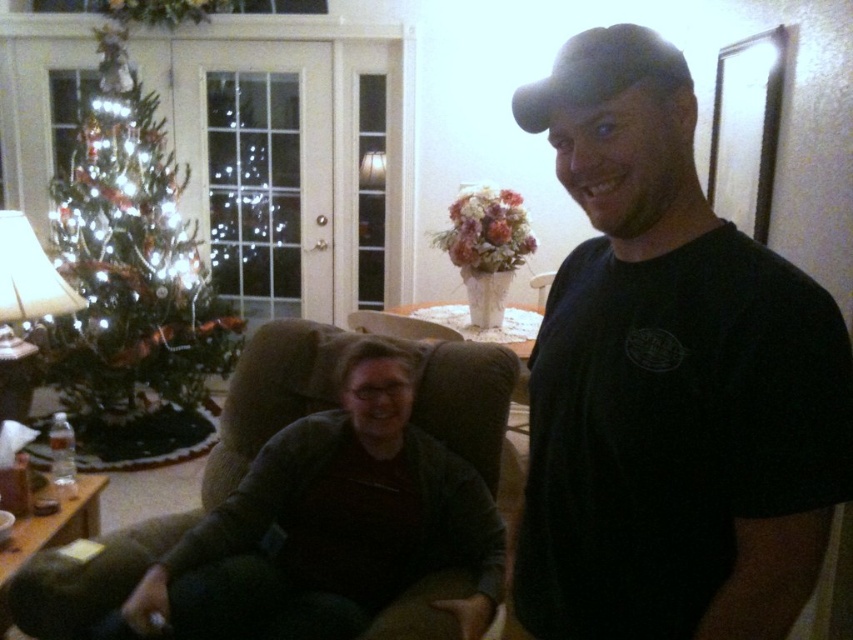
Question: Does black matte t-shirt at center have a smaller size compared to brown fabric couch at lower left?

Choices:
 (A) yes
 (B) no

Answer: (A)

Question: Which point is closer to the camera taking this photo?

Choices:
 (A) (732, 436)
 (B) (96, 342)

Answer: (A)

Question: Does green matte christmas tree at left appear under brown fabric couch at lower left?

Choices:
 (A) yes
 (B) no

Answer: (B)

Question: Which point is farther from the camera taking this photo?

Choices:
 (A) (634, 200)
 (B) (463, 424)
 (C) (88, 216)

Answer: (C)

Question: Does green matte christmas tree at left come in front of brown fabric couch at lower left?

Choices:
 (A) no
 (B) yes

Answer: (A)

Question: Which point appears closest to the camera in this image?

Choices:
 (A) (86, 340)
 (B) (459, 580)

Answer: (B)